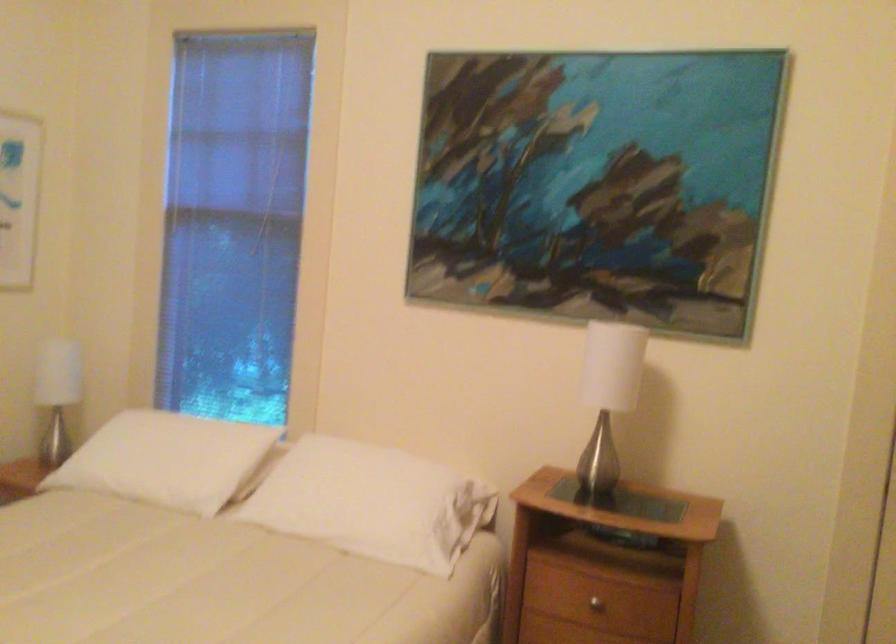
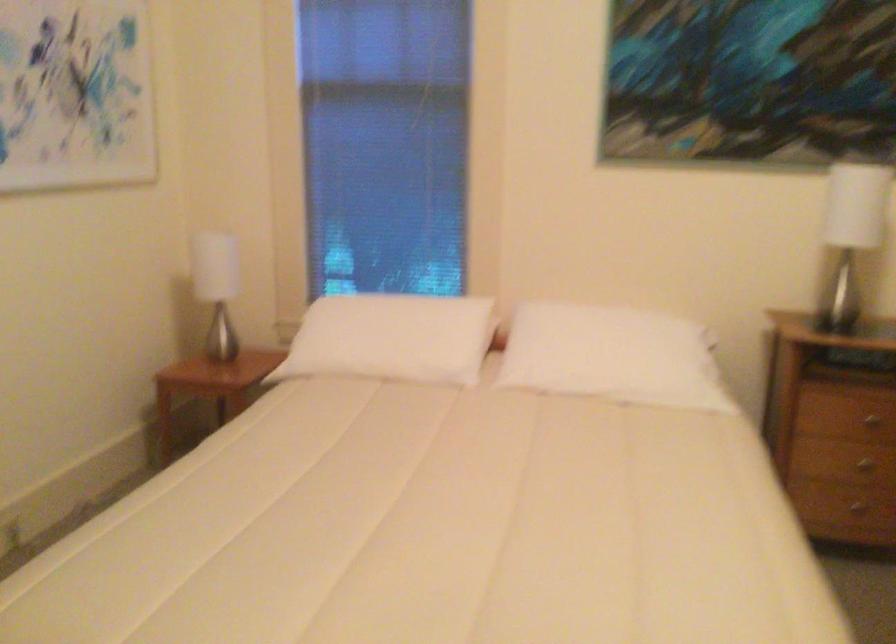
Question: Which direction would the cameraman need to move to produce the second image? Reply with the corresponding letter.

Choices:
 (A) Left
 (B) Right
 (C) Forward
 (D) Backward

Answer: (A)